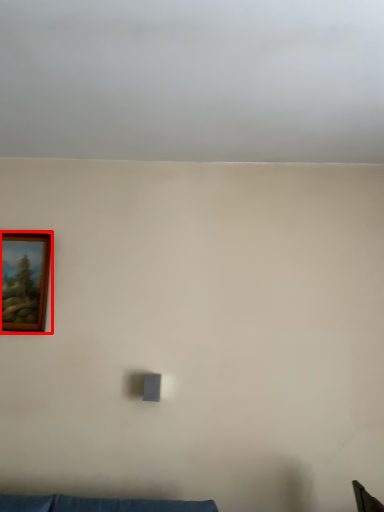
Question: Considering the relative positions of picture frame (annotated by the red box) and cloud in the image provided, where is picture frame (annotated by the red box) located with respect to the staircase?

Choices:
 (A) right
 (B) left

Answer: (B)